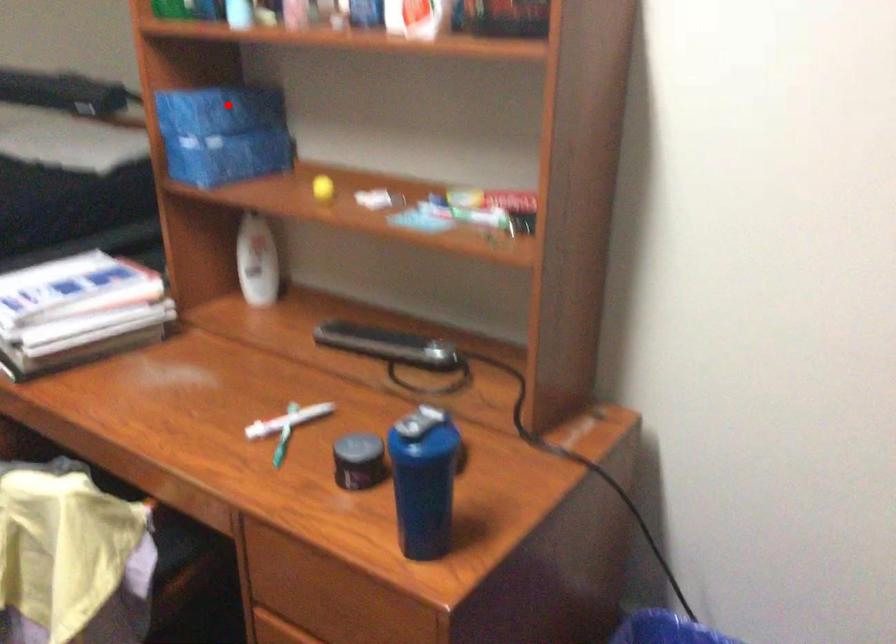
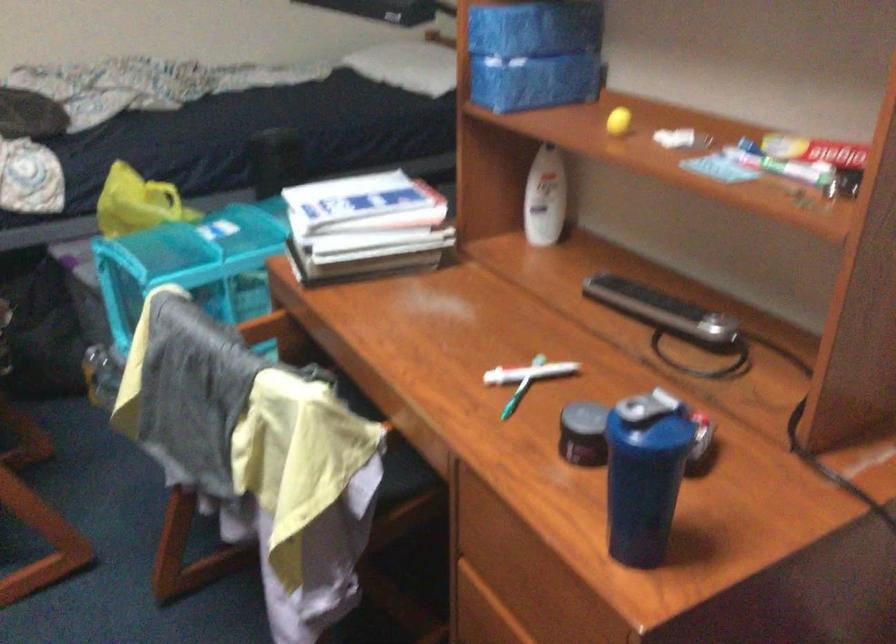
Question: I am providing you with two images of the same scene from different viewpoints. A red point is marked on the first image. Is the red point's position out of view in image 2?

Choices:
 (A) Yes
 (B) No

Answer: (B)